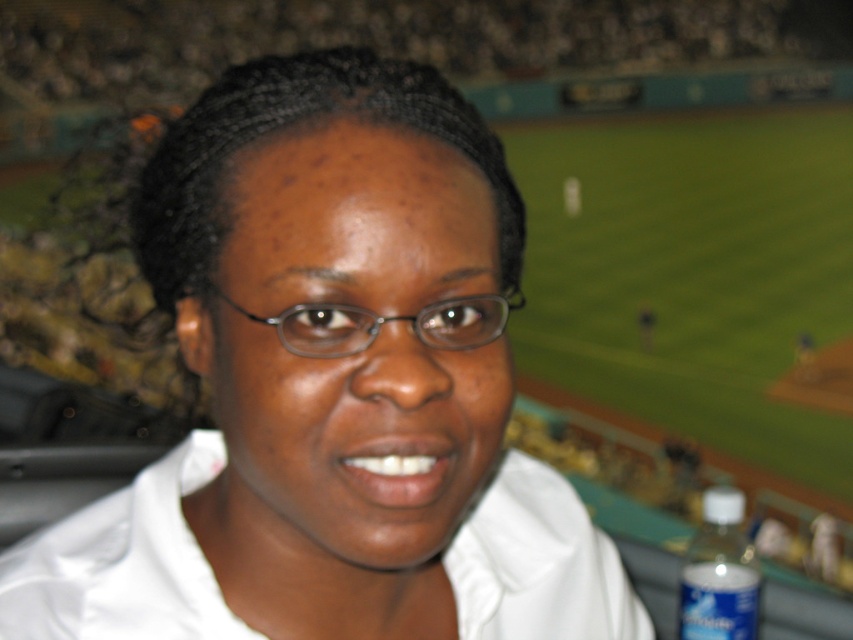
How distant is white cotton shirt at center from blue plastic bottle at lower right?

10.73 inches

Is white cotton shirt at center below blue plastic bottle at lower right?

No, white cotton shirt at center is not below blue plastic bottle at lower right.

Between point (524, 604) and point (735, 524), which one is positioned in front?

Point (524, 604)

The width and height of the screenshot is (853, 640). Find the location of `white cotton shirt at center`. white cotton shirt at center is located at coordinates (123, 563).

Does point (178, 573) come in front of point (734, 490)?

Yes, point (178, 573) is in front of point (734, 490).

Measure the distance between white matte shirt at center and camera.

15.18 inches

What do you see at coordinates (331, 387) in the screenshot? I see `white matte shirt at center` at bounding box center [331, 387].

Where is `white matte shirt at center`? white matte shirt at center is located at coordinates (331, 387).

Is white cotton shirt at center to the right of transparent plastic glasses at center from the viewer's perspective?

Incorrect, white cotton shirt at center is not on the right side of transparent plastic glasses at center.

Can you confirm if white cotton shirt at center is thinner than transparent plastic glasses at center?

No, white cotton shirt at center is not thinner than transparent plastic glasses at center.

Describe the element at coordinates (123, 563) in the screenshot. I see `white cotton shirt at center` at that location.

At what (x,y) coordinates should I click in order to perform the action: click on white cotton shirt at center. Please return your answer as a coordinate pair (x, y). The image size is (853, 640). Looking at the image, I should click on (123, 563).